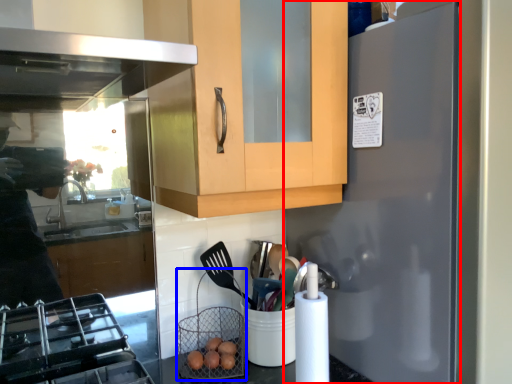
Question: Among these objects, which one is farthest to the camera, refrigerator (highlighted by a red box) or basket (highlighted by a blue box)?

Choices:
 (A) refrigerator
 (B) basket

Answer: (B)